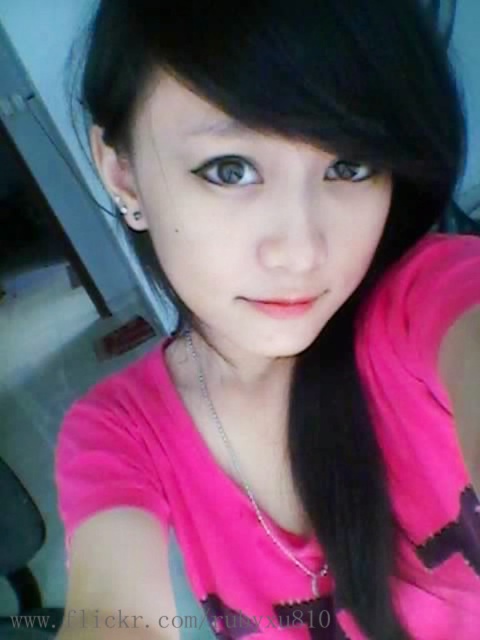
Question: Which point is closer to the camera?

Choices:
 (A) (231, 464)
 (B) (373, 173)

Answer: (B)

Question: Which of the following is the farthest from the observer?

Choices:
 (A) (324, 173)
 (B) (247, 176)
 (C) (324, 570)

Answer: (C)

Question: Does silver chain necklace at center appear on the left side of brown matte eye at center?

Choices:
 (A) yes
 (B) no

Answer: (A)

Question: Can you confirm if blue glossy eye at center is positioned above brown matte eye at center?

Choices:
 (A) yes
 (B) no

Answer: (B)

Question: Considering the relative positions of blue glossy eye at center and brown matte eye at center in the image provided, where is blue glossy eye at center located with respect to brown matte eye at center?

Choices:
 (A) left
 (B) right

Answer: (A)

Question: Which of the following is the closest to the observer?

Choices:
 (A) silver chain necklace at center
 (B) brown matte eye at center
 (C) blue glossy eye at center

Answer: (C)